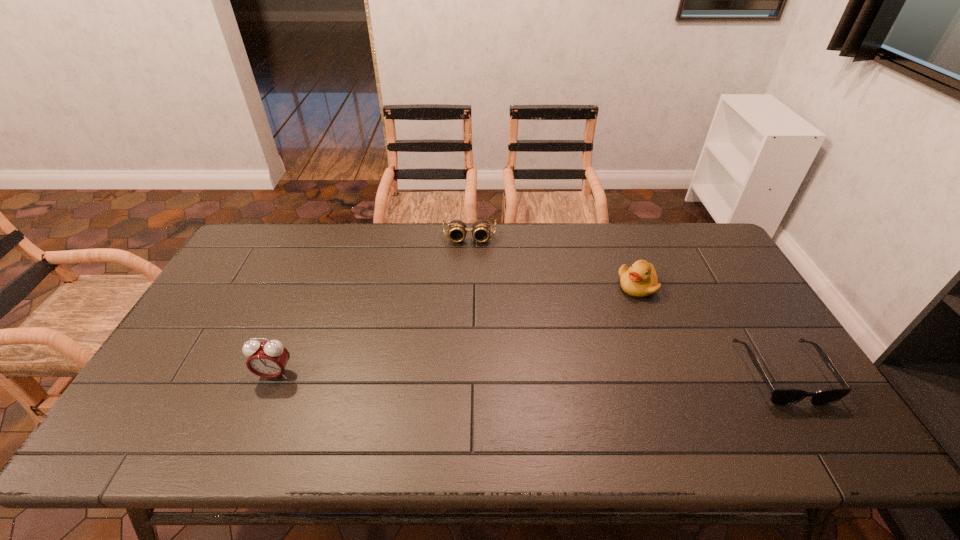
Where is `free space between the second shortest object and the third nearest object`? free space between the second shortest object and the third nearest object is located at coordinates (554, 262).

The image size is (960, 540). In order to click on free space between the second object from right to left and the alarm clock in this screenshot , I will do `click(456, 330)`.

Where is `blank region between the rightmost object and the farthest object`? Image resolution: width=960 pixels, height=540 pixels. blank region between the rightmost object and the farthest object is located at coordinates (626, 306).

Identify the location of free space that is in between the farthest object and the tallest object. (372, 306).

Where is `object identified as the second closest to the sunglasses`? Image resolution: width=960 pixels, height=540 pixels. object identified as the second closest to the sunglasses is located at coordinates (457, 229).

Point out which object is positioned as the third nearest to the tallest object. Please provide its 2D coordinates. Your answer should be formatted as a tuple, i.e. [(x, y)], where the tuple contains the x and y coordinates of a point satisfying the conditions above.

[(779, 396)]